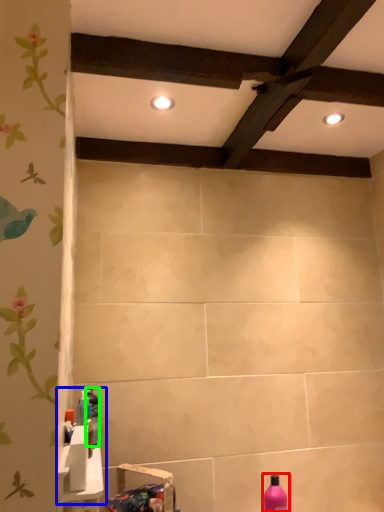
Question: Which is nearer to the bottle (highlighted by a red box)? sink (highlighted by a blue box) or bottle (highlighted by a green box).

Choices:
 (A) sink
 (B) bottle

Answer: (B)